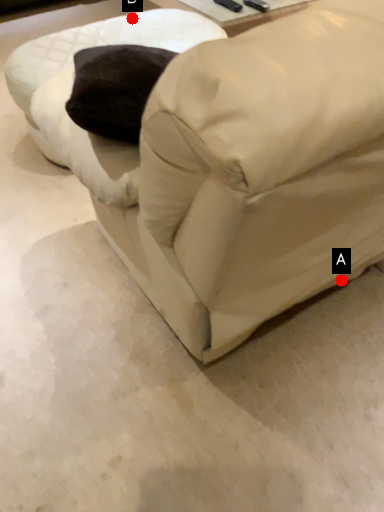
Question: Two points are circled on the image, labeled by A and B beside each circle. Which point is farther to the camera?

Choices:
 (A) A is further
 (B) B is further

Answer: (B)